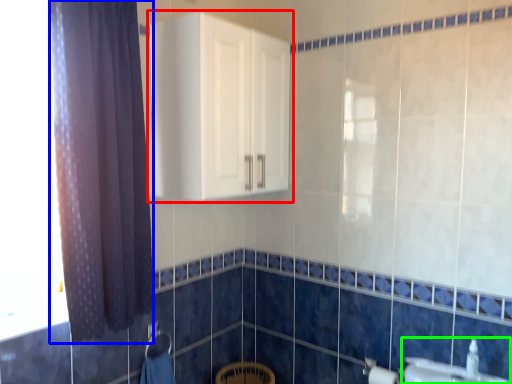
Question: Based on their relative distances, which object is farther from cabinetry (highlighted by a red box)? Choose from curtain (highlighted by a blue box) and sink (highlighted by a green box).

Choices:
 (A) curtain
 (B) sink

Answer: (B)